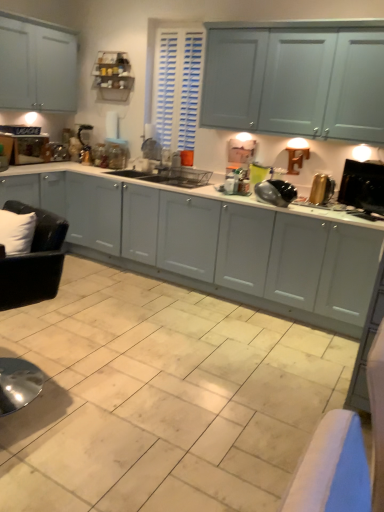
Question: Is beige ceramic tile at center smaller than black plastic monitor at right, which is counted as the first appliance, starting from the right?

Choices:
 (A) no
 (B) yes

Answer: (A)

Question: From the image's perspective, is beige ceramic tile at center beneath black plastic monitor at right, positioned as the third appliance in left-to-right order?

Choices:
 (A) yes
 (B) no

Answer: (A)

Question: Is the position of beige ceramic tile at center more distant than that of black plastic monitor at right, which is counted as the first appliance, starting from the right?

Choices:
 (A) no
 (B) yes

Answer: (A)

Question: From the image's perspective, is beige ceramic tile at center located above black plastic monitor at right, positioned as the third appliance in left-to-right order?

Choices:
 (A) yes
 (B) no

Answer: (B)

Question: Is beige ceramic tile at center facing towards black plastic monitor at right, positioned as the third appliance in left-to-right order?

Choices:
 (A) no
 (B) yes

Answer: (A)

Question: Does beige ceramic tile at center have a larger size compared to black plastic monitor at right, positioned as the third appliance in left-to-right order?

Choices:
 (A) yes
 (B) no

Answer: (A)

Question: Is the position of black plastic monitor at right, positioned as the third appliance in left-to-right order, less distant than that of gold metallic toaster at right, the second appliance when ordered from right to left?

Choices:
 (A) yes
 (B) no

Answer: (A)

Question: Does black plastic monitor at right, positioned as the third appliance in left-to-right order, have a greater width compared to gold metallic toaster at right, acting as the second appliance starting from the left?

Choices:
 (A) yes
 (B) no

Answer: (B)

Question: Could gold metallic toaster at right, the second appliance when ordered from right to left, be considered to be inside black plastic monitor at right, positioned as the third appliance in left-to-right order?

Choices:
 (A) yes
 (B) no

Answer: (B)

Question: From the image's perspective, is black plastic monitor at right, positioned as the third appliance in left-to-right order, beneath gold metallic toaster at right, the second appliance when ordered from right to left?

Choices:
 (A) yes
 (B) no

Answer: (A)

Question: Can you confirm if black plastic monitor at right, which is counted as the first appliance, starting from the right, is shorter than gold metallic toaster at right, acting as the second appliance starting from the left?

Choices:
 (A) yes
 (B) no

Answer: (B)

Question: Is black plastic monitor at right, which is counted as the first appliance, starting from the right, far from gold metallic toaster at right, acting as the second appliance starting from the left?

Choices:
 (A) no
 (B) yes

Answer: (A)

Question: Can you confirm if black glossy pan at center, which ranks as the third appliance in right-to-left order, is taller than black plastic monitor at right, positioned as the third appliance in left-to-right order?

Choices:
 (A) yes
 (B) no

Answer: (B)